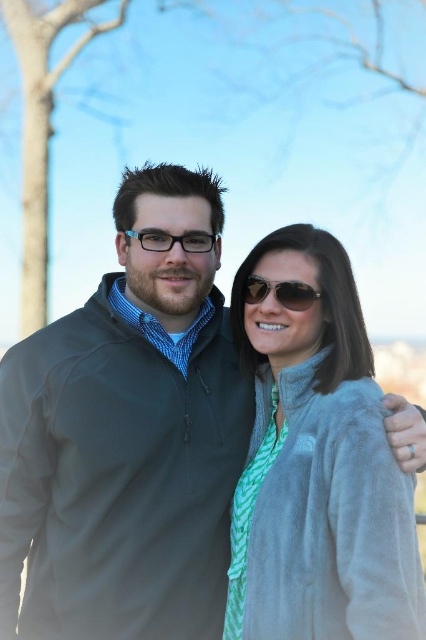
Does fuzzy gray jacket at center come in front of transparent plastic glasses at center?

Yes, fuzzy gray jacket at center is in front of transparent plastic glasses at center.

Which of these two, fuzzy gray jacket at center or transparent plastic glasses at center, stands shorter?

Standing shorter between the two is transparent plastic glasses at center.

Where is `fuzzy gray jacket at center`? The height and width of the screenshot is (640, 426). fuzzy gray jacket at center is located at coordinates (317, 465).

Is gray fleece jacket at center above shiny black sunglasses at center?

No.

Between gray fleece jacket at center and shiny black sunglasses at center, which one has less height?

shiny black sunglasses at center is shorter.

Which is behind, point (28, 480) or point (261, 285)?

Point (28, 480)

Locate an element on the screen. gray fleece jacket at center is located at coordinates (126, 438).

How much distance is there between shiny black sunglasses at center and transparent plastic glasses at center?

The distance of shiny black sunglasses at center from transparent plastic glasses at center is 38.55 inches.

Is shiny black sunglasses at center positioned behind transparent plastic glasses at center?

No, shiny black sunglasses at center is closer to the viewer.

This screenshot has height=640, width=426. What do you see at coordinates (279, 292) in the screenshot?
I see `shiny black sunglasses at center` at bounding box center [279, 292].

The image size is (426, 640). In order to click on shiny black sunglasses at center in this screenshot , I will do point(279,292).